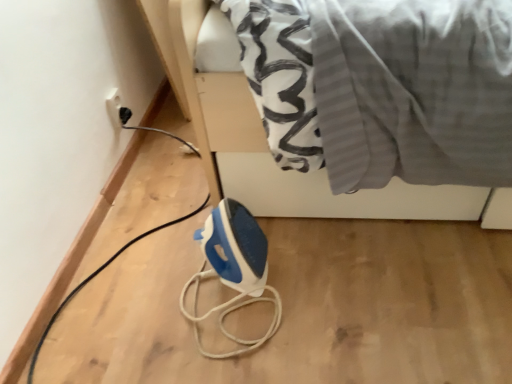
Describe the element at coordinates (234, 246) in the screenshot. I see `blue plastic iron at lower center` at that location.

This screenshot has height=384, width=512. Describe the element at coordinates (266, 141) in the screenshot. I see `white glossy bed at upper center` at that location.

Where is `white glossy bed at upper center`? The height and width of the screenshot is (384, 512). white glossy bed at upper center is located at coordinates (266, 141).

I want to click on blue plastic iron at lower center, so click(x=234, y=246).

Who is taller, blue plastic iron at lower center or white plastic socket at upper left?

Standing taller between the two is blue plastic iron at lower center.

From a real-world perspective, is blue plastic iron at lower center over white plastic socket at upper left?

Incorrect, from a real-world perspective, blue plastic iron at lower center is lower than white plastic socket at upper left.

From the image's perspective, who appears lower, blue plastic iron at lower center or white plastic socket at upper left?

blue plastic iron at lower center is shown below in the image.

Considering the positions of point (213, 236) and point (116, 103), is point (213, 236) closer or farther from the camera than point (116, 103)?

Point (213, 236) appears to be closer to the viewer than point (116, 103).

Considering the relative positions of white glossy bed at upper center and blue plastic iron at lower center in the image provided, is white glossy bed at upper center to the right of blue plastic iron at lower center from the viewer's perspective?

Yes, white glossy bed at upper center is to the right of blue plastic iron at lower center.

From a real-world perspective, is white glossy bed at upper center positioned above or below blue plastic iron at lower center?

In terms of real-world spatial position, white glossy bed at upper center is above blue plastic iron at lower center.

Which object is closer to the camera, white glossy bed at upper center or blue plastic iron at lower center?

Positioned in front is white glossy bed at upper center.

Could you tell me if white glossy bed at upper center is turned towards blue plastic iron at lower center?

Yes, white glossy bed at upper center is facing blue plastic iron at lower center.

Considering the sizes of objects white glossy bed at upper center and white plastic socket at upper left in the image provided, who is shorter, white glossy bed at upper center or white plastic socket at upper left?

Standing shorter between the two is white plastic socket at upper left.

From a real-world perspective, is white glossy bed at upper center on top of white plastic socket at upper left?

Indeed, from a real-world perspective, white glossy bed at upper center stands above white plastic socket at upper left.

From the image's perspective, is white glossy bed at upper center below white plastic socket at upper left?

No, from the image's perspective, white glossy bed at upper center is not below white plastic socket at upper left.

Based on the photo, is white glossy bed at upper center aimed at white plastic socket at upper left?

No, white glossy bed at upper center does not turn towards white plastic socket at upper left.

Locate an element on the screen. Image resolution: width=512 pixels, height=384 pixels. electric outlet that is above the blue plastic iron at lower center (from a real-world perspective) is located at coordinates [117, 110].

From a real-world perspective, which is physically below, white plastic socket at upper left or blue plastic iron at lower center?

From a 3D spatial view, blue plastic iron at lower center is below.

Is white plastic socket at upper left oriented away from blue plastic iron at lower center?

No, white plastic socket at upper left is not facing away from blue plastic iron at lower center.

Is the depth of white plastic socket at upper left greater than that of blue plastic iron at lower center?

Yes, it is behind blue plastic iron at lower center.

From a real-world perspective, is blue plastic iron at lower center over white glossy bed at upper center?

No, from a real-world perspective, blue plastic iron at lower center is not over white glossy bed at upper center

Who is more distant, blue plastic iron at lower center or white glossy bed at upper center?

Positioned behind is blue plastic iron at lower center.

Between blue plastic iron at lower center and white glossy bed at upper center, which one appears on the left side from the viewer's perspective?

Positioned to the left is blue plastic iron at lower center.

From the image's perspective, which one is positioned lower, blue plastic iron at lower center or white glossy bed at upper center?

blue plastic iron at lower center.

Looking at this image, from a real-world perspective, is white plastic socket at upper left on top of white glossy bed at upper center?

No, from a real-world perspective, white plastic socket at upper left is not on top of white glossy bed at upper center.

Is white plastic socket at upper left thinner than white glossy bed at upper center?

Indeed, white plastic socket at upper left has a lesser width compared to white glossy bed at upper center.

Which object is closer to the camera, white plastic socket at upper left or white glossy bed at upper center?

Positioned in front is white glossy bed at upper center.

I want to click on furniture lying above the white plastic socket at upper left (from the image's perspective), so click(x=266, y=141).

At what (x,y) coordinates should I click in order to perform the action: click on appliance located in front of the white plastic socket at upper left. Please return your answer as a coordinate pair (x, y). Looking at the image, I should click on (234, 246).

Find the location of a particular element. This screenshot has height=384, width=512. appliance below the white glossy bed at upper center (from the image's perspective) is located at coordinates (234, 246).

Based on their spatial positions, is white plastic socket at upper left or blue plastic iron at lower center further from white glossy bed at upper center?

white plastic socket at upper left lies further to white glossy bed at upper center than the other object.

Looking at the image, which one is located closer to white glossy bed at upper center, blue plastic iron at lower center or white plastic socket at upper left?

blue plastic iron at lower center is closer to white glossy bed at upper center.

Which object lies nearer to the anchor point white plastic socket at upper left, blue plastic iron at lower center or white glossy bed at upper center?

white glossy bed at upper center.

When comparing their distances from blue plastic iron at lower center, does white plastic socket at upper left or white glossy bed at upper center seem closer?

white glossy bed at upper center.

Based on their spatial positions, is white glossy bed at upper center or blue plastic iron at lower center closer to white plastic socket at upper left?

The object closer to white plastic socket at upper left is white glossy bed at upper center.

Based on their spatial positions, is white glossy bed at upper center or white plastic socket at upper left closer to blue plastic iron at lower center?

white glossy bed at upper center lies closer to blue plastic iron at lower center than the other object.

Where is `appliance located between white plastic socket at upper left and white glossy bed at upper center in the left-right direction`? appliance located between white plastic socket at upper left and white glossy bed at upper center in the left-right direction is located at coordinates (234, 246).